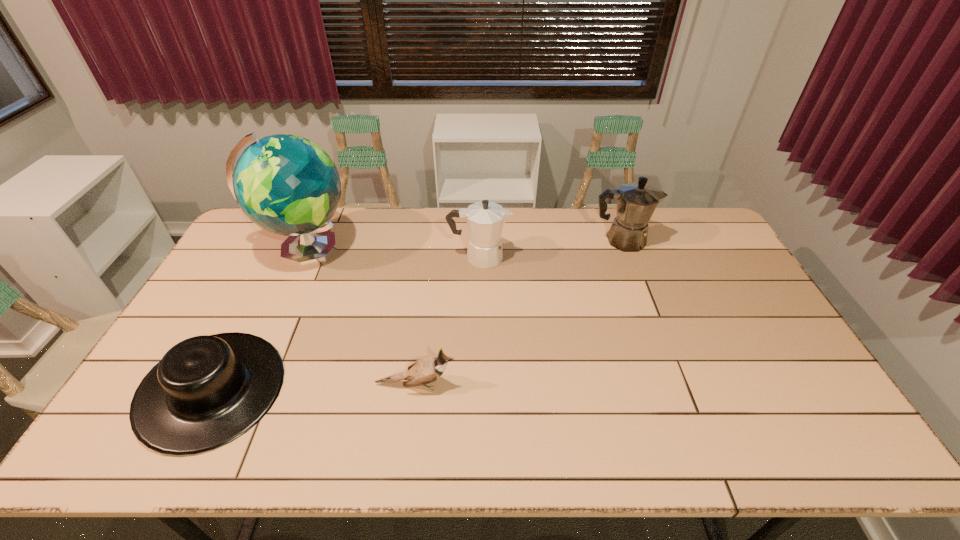
Identify which object is the third nearest to the tallest object. Please provide its 2D coordinates. Your answer should be formatted as a tuple, i.e. [(x, y)], where the tuple contains the x and y coordinates of a point satisfying the conditions above.

[(424, 371)]

Find the location of a particular element. object identified as the fourth closest to the left coffeepot is located at coordinates (206, 391).